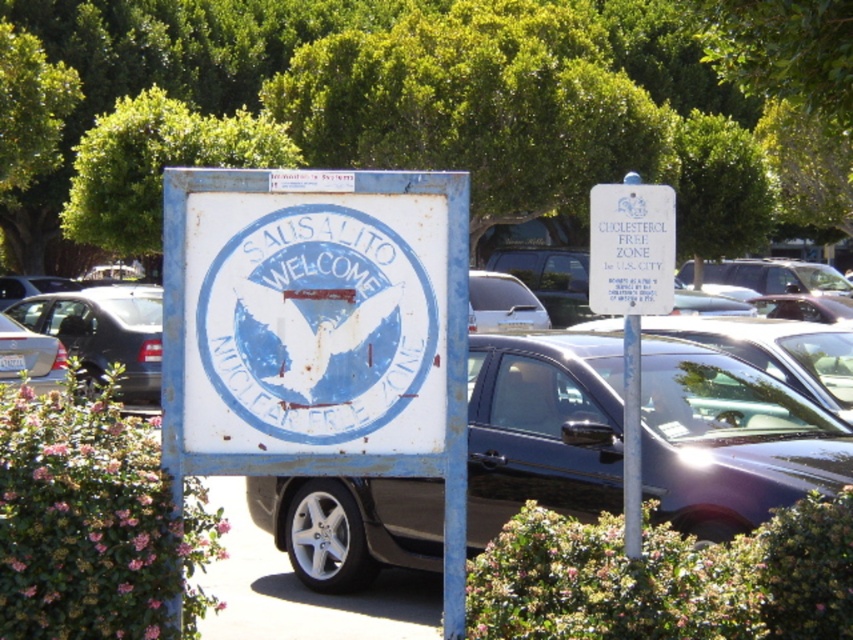
Describe the element at coordinates (730, 440) in the screenshot. This screenshot has height=640, width=853. I see `metallic gray sedan at center` at that location.

Which is behind, point (508, 499) or point (492, 300)?

The point (492, 300) is more distant.

Identify the location of metallic gray sedan at center. The width and height of the screenshot is (853, 640). (730, 440).

Is the position of satin silver car at center less distant than that of silver metallic sedan at left?

Yes, satin silver car at center is in front of silver metallic sedan at left.

Is point (518, 314) positioned before point (26, 330)?

No, (518, 314) is behind (26, 330).

What do you see at coordinates (502, 304) in the screenshot?
I see `satin silver car at center` at bounding box center [502, 304].

Locate an element on the screen. The height and width of the screenshot is (640, 853). satin silver car at center is located at coordinates (502, 304).

Does metallic gray sedan at center have a lesser height compared to metallic silver sedan at center?

Yes.

Who is more distant from viewer, (368, 488) or (840, 288)?

The point (840, 288) is more distant.

The height and width of the screenshot is (640, 853). In order to click on metallic gray sedan at center in this screenshot , I will do `click(730, 440)`.